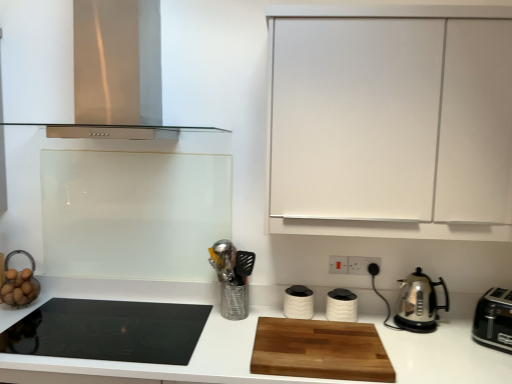
Question: Is stainless steel range hood at upper left wider or thinner than wooden cutting board at center?

Choices:
 (A) thin
 (B) wide

Answer: (B)

Question: Considering the positions of stainless steel range hood at upper left and wooden cutting board at center in the image, is stainless steel range hood at upper left taller or shorter than wooden cutting board at center?

Choices:
 (A) tall
 (B) short

Answer: (A)

Question: Which object is positioned farthest from the white plastic electric outlet at center-right, acting as the third electric outlet starting from the right?

Choices:
 (A) stainless steel range hood at upper left
 (B) polished stainless steel kettle at right, which is the 3th kitchen appliance in left-to-right order
 (C) white matte cabinet at upper right
 (D) wooden cutting board at center
 (E) metallic silver utensil holder at center

Answer: (A)

Question: Based on their relative distances, which object is farther from the wooden cutting board at center?

Choices:
 (A) white matte canister at center, the fourth kitchen appliance viewed from the right
 (B) white plastic electric outlet at center-right, acting as the third electric outlet starting from the right
 (C) metallic silver utensil holder at center
 (D) black plastic electric outlet at center-right, arranged as the 1th electric outlet when viewed from the right
 (E) wooden cutting board at center

Answer: (D)